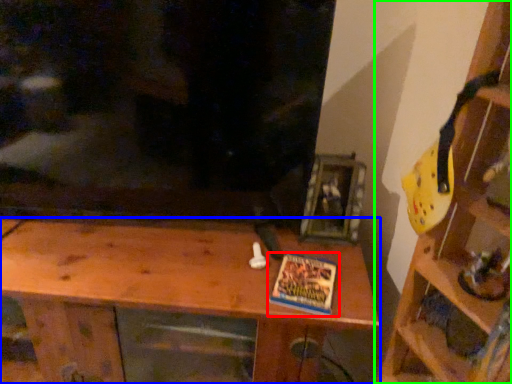
Question: Which object is the farthest from book (highlighted by a red box)? Choose among these: shelf (highlighted by a blue box) or shelf (highlighted by a green box).

Choices:
 (A) shelf
 (B) shelf

Answer: (B)